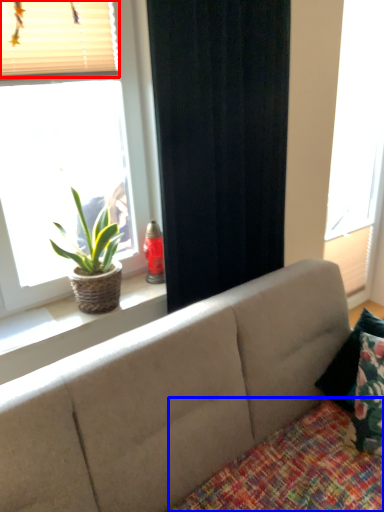
Question: Which object appears closest to the camera in this image, blind (highlighted by a red box) or quilt (highlighted by a blue box)?

Choices:
 (A) blind
 (B) quilt

Answer: (B)